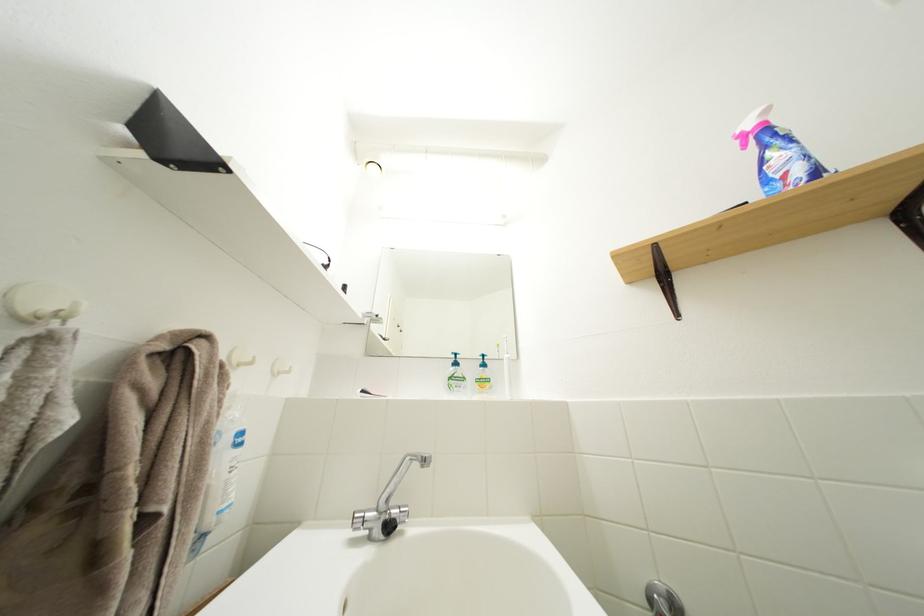
Locate an element on the screen. This screenshot has width=924, height=616. pink spray trigger is located at coordinates (751, 127).